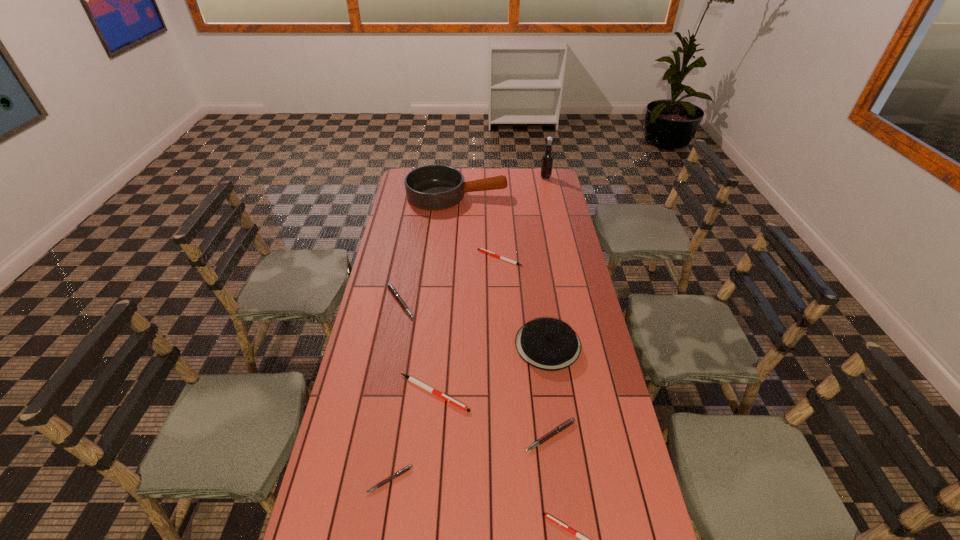
Where is `the tallest object`? The image size is (960, 540). the tallest object is located at coordinates (547, 160).

This screenshot has width=960, height=540. In order to click on the farthest object in this screenshot , I will do `click(547, 160)`.

The height and width of the screenshot is (540, 960). What are the coordinates of `the eighth nearest object` in the screenshot? It's located at (432, 187).

Find the location of a particular element. The height and width of the screenshot is (540, 960). the second tallest object is located at coordinates [432, 187].

Locate an element on the screen. The width and height of the screenshot is (960, 540). the seventh shortest object is located at coordinates (549, 344).

Identify the location of the biggest pink pen. (391, 288).

This screenshot has height=540, width=960. I want to click on the farthest pink pen, so [391, 288].

The image size is (960, 540). Identify the location of the leftmost white pen. (410, 378).

In order to click on the biggest white pen in this screenshot , I will do `click(410, 378)`.

You are a GUI agent. You are given a task and a screenshot of the screen. Output one action in this format:
    pyautogui.click(x=<x>, y=<y>)
    Task: Click on the seventh farthest object
    The height and width of the screenshot is (540, 960).
    Given the screenshot: What is the action you would take?
    pyautogui.click(x=557, y=430)